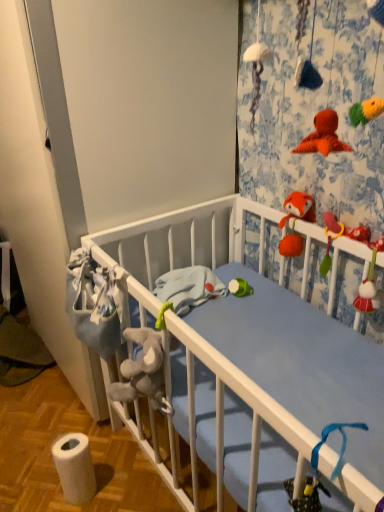
This screenshot has height=512, width=384. I want to click on free area behind white matte toilet paper at lower left, so click(98, 449).